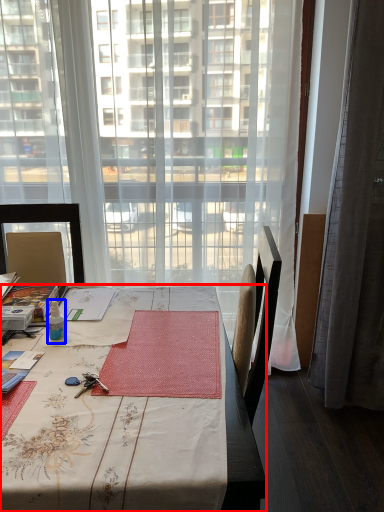
Question: Which point is further to the camera, desk (highlighted by a red box) or bottle (highlighted by a blue box)?

Choices:
 (A) desk
 (B) bottle

Answer: (B)